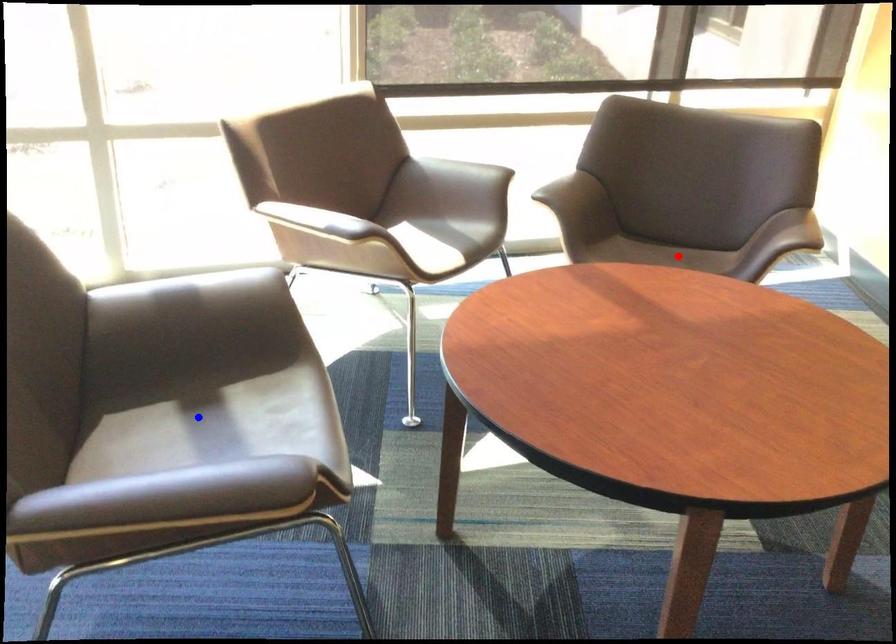
Question: Which of the two points in the image is closer to the camera?

Choices:
 (A) Blue point is closer.
 (B) Red point is closer.

Answer: (A)